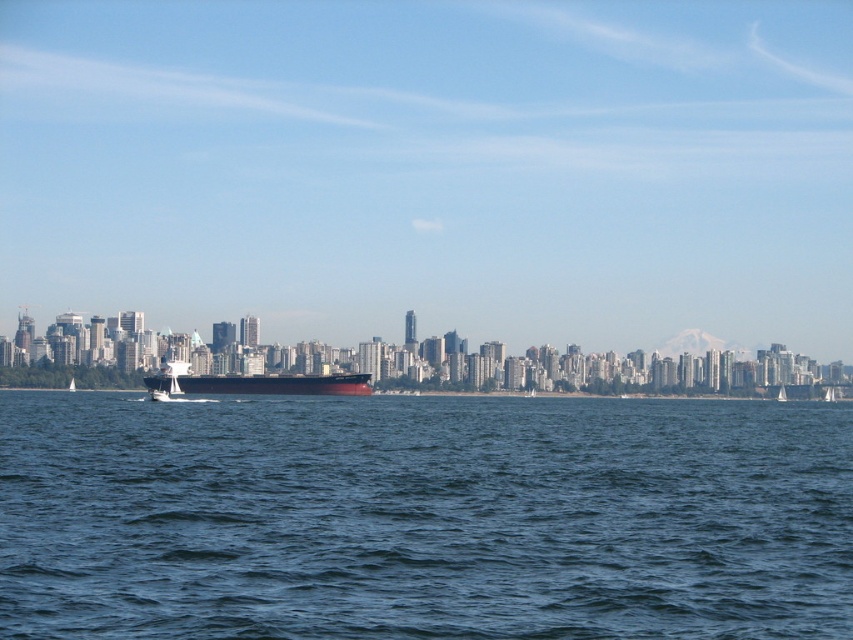
Question: Can you confirm if blue water at center is positioned to the right of smooth black ship at center?

Choices:
 (A) no
 (B) yes

Answer: (B)

Question: Which point is closer to the camera taking this photo?

Choices:
 (A) (830, 420)
 (B) (172, 394)

Answer: (A)

Question: Does blue water at center appear on the left side of smooth black ship at center?

Choices:
 (A) no
 (B) yes

Answer: (A)

Question: Which object is farther from the camera taking this photo?

Choices:
 (A) smooth black ship at center
 (B) blue water at center

Answer: (A)

Question: Is blue water at center to the right of smooth black ship at center from the viewer's perspective?

Choices:
 (A) no
 (B) yes

Answer: (B)